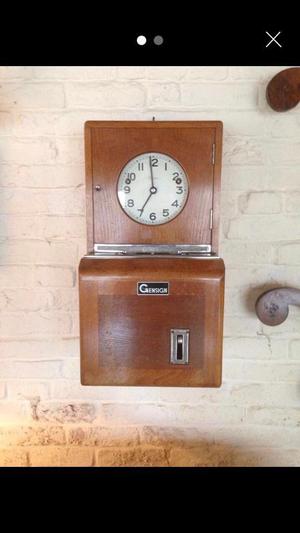
Where is `switch`? This screenshot has width=300, height=533. switch is located at coordinates (181, 350).